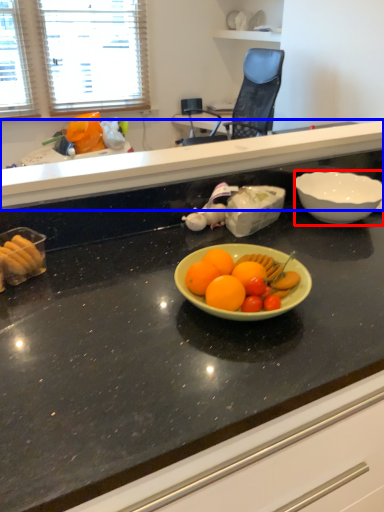
Question: Which object appears farthest to the camera in this image, bowl (highlighted by a red box) or countertop (highlighted by a blue box)?

Choices:
 (A) bowl
 (B) countertop

Answer: (A)